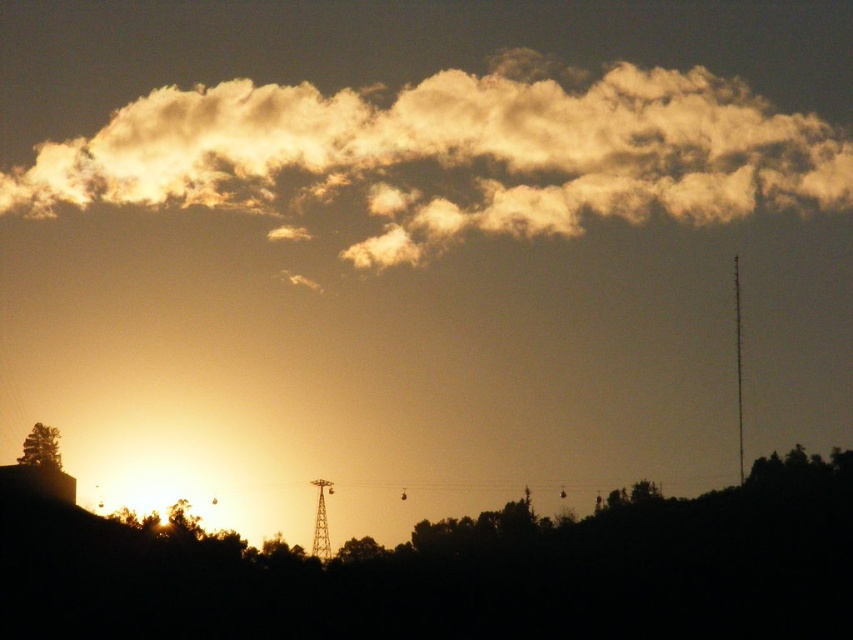
Does point (383, 157) come in front of point (358, 545)?

No, (383, 157) is further to viewer.

Is golden fluffy cloud at upper center wider than green matte tree at center?

Yes, golden fluffy cloud at upper center is wider than green matte tree at center.

The image size is (853, 640). What do you see at coordinates (454, 154) in the screenshot? I see `golden fluffy cloud at upper center` at bounding box center [454, 154].

The height and width of the screenshot is (640, 853). In order to click on golden fluffy cloud at upper center in this screenshot , I will do `click(454, 154)`.

Which is in front, point (723, 156) or point (42, 451)?

Point (42, 451)

Describe the element at coordinates (454, 154) in the screenshot. I see `golden fluffy cloud at upper center` at that location.

The image size is (853, 640). What are the coordinates of `golden fluffy cloud at upper center` in the screenshot? It's located at (454, 154).

Is green leafy tree at lower left smaller than green matte tree at center?

No.

Is green leafy tree at lower left in front of green matte tree at center?

No, it is behind green matte tree at center.

Which is in front, point (39, 433) or point (338, 561)?

Point (338, 561) is in front.

Locate an element on the screen. Image resolution: width=853 pixels, height=640 pixels. green leafy tree at lower left is located at coordinates (41, 449).